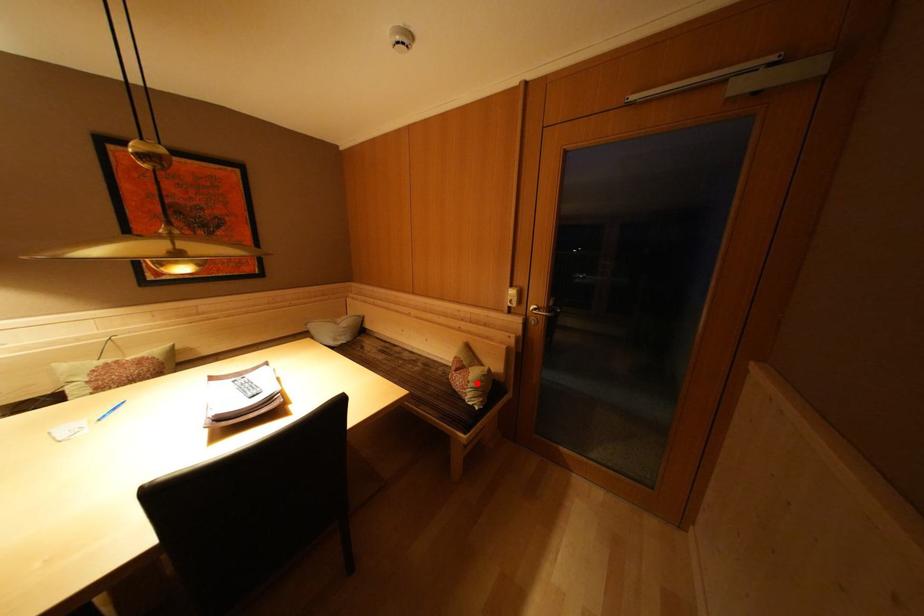
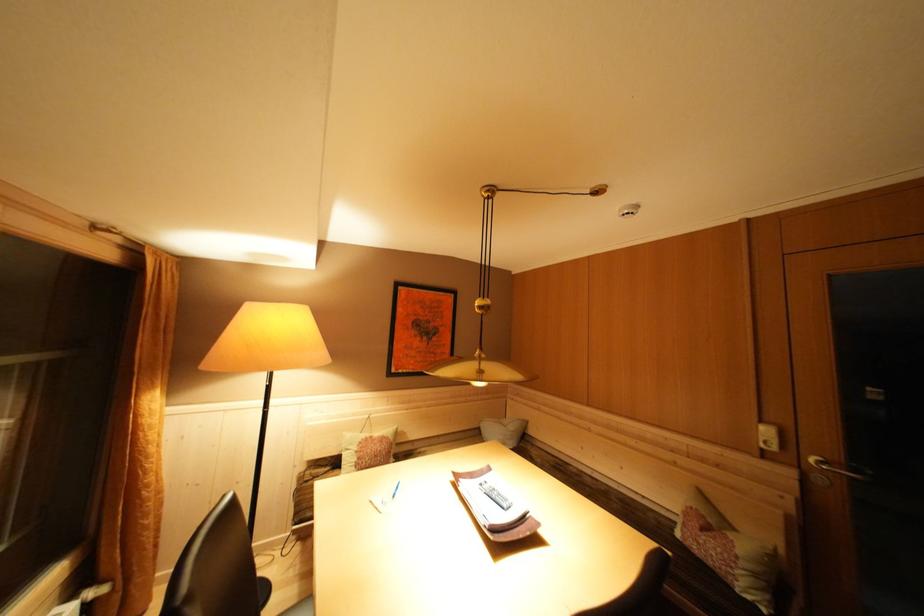
The point at the highlighted location is marked in the first image. Where is the corresponding point in the second image?

(746, 557)